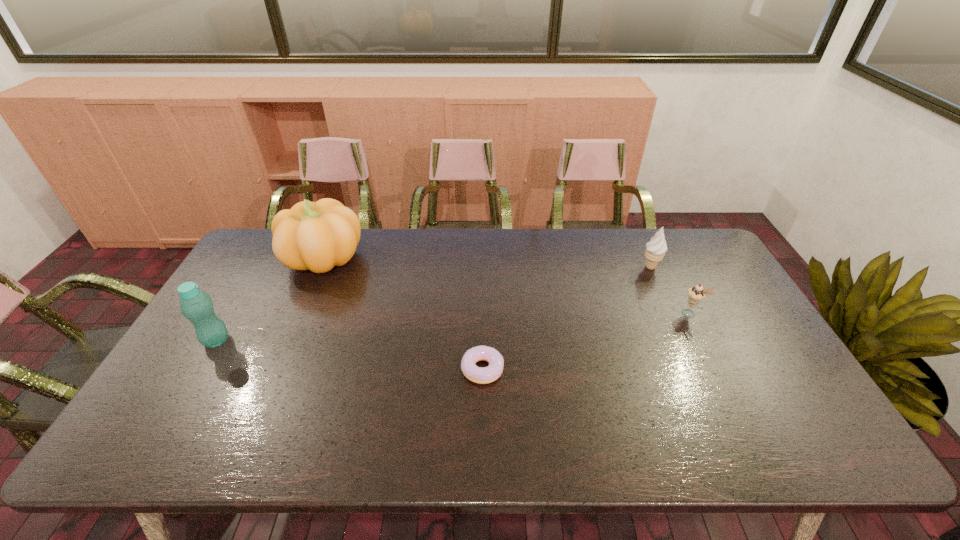
Find the location of a particular element. free space that satisfies the following two spatial constraints: 1. on the back side of the third farthest object; 2. on the right side of the shortest object is located at coordinates (482, 313).

Identify the location of free space that satisfies the following two spatial constraints: 1. at the front cap of the leftmost object; 2. on the right side of the third object from left to right. (200, 369).

At what (x,y) coordinates should I click in order to perform the action: click on vacant position in the image that satisfies the following two spatial constraints: 1. at the front cap of the second nearest object; 2. on the right side of the doughnut. Please return your answer as a coordinate pair (x, y). The height and width of the screenshot is (540, 960). Looking at the image, I should click on (200, 369).

Locate an element on the screen. The width and height of the screenshot is (960, 540). vacant region that satisfies the following two spatial constraints: 1. on the back side of the third object from right to left; 2. on the left side of the third farthest object is located at coordinates (482, 313).